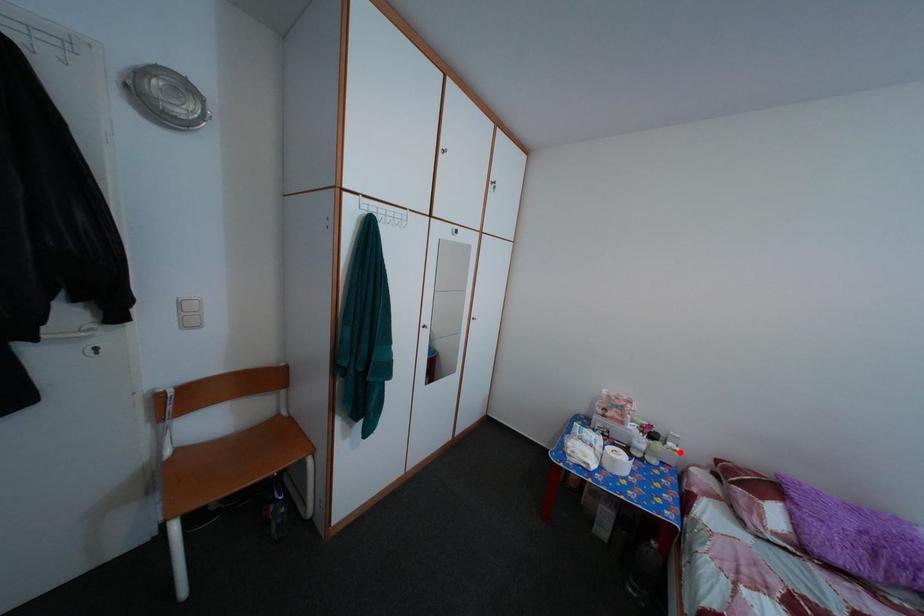
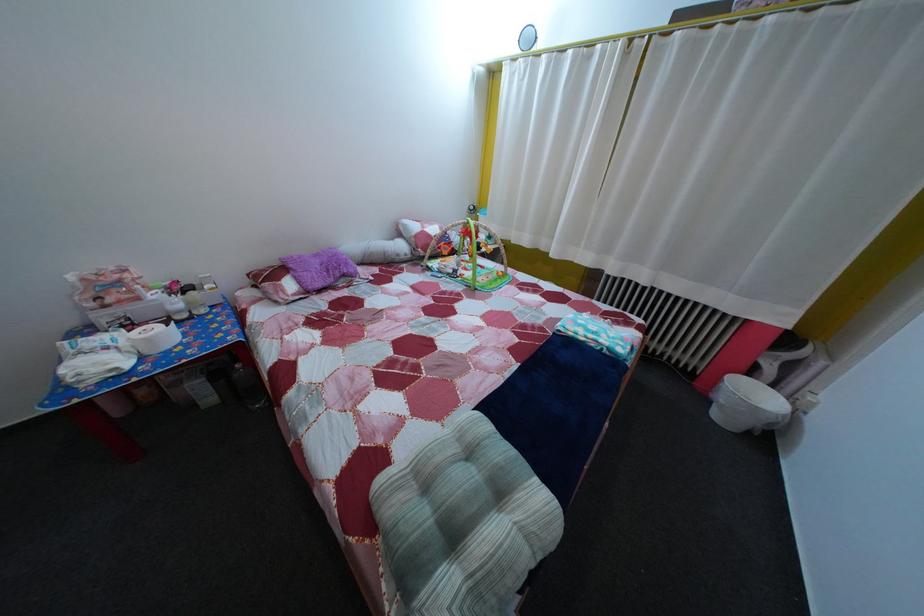
Question: A red point is marked in image1. In image2, is the corresponding 3D point closer to the camera or farther? Reply with the corresponding letter.

Choices:
 (A) The corresponding 3D point is closer.
 (B) The corresponding 3D point is farther.

Answer: (A)